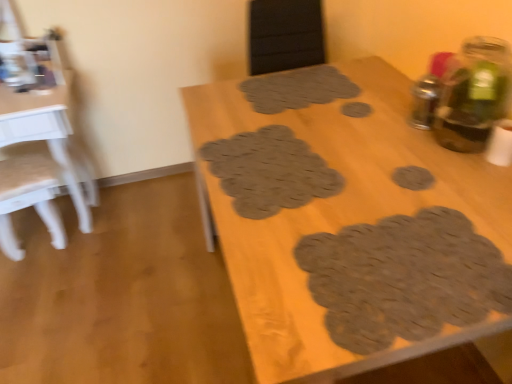
This screenshot has width=512, height=384. What are the coordinates of `vacant space in between brown textured mat at center, arranged as the second footprint when viewed from the front, and brown felt coaster at center, which ranks as the 4th footprint in bottom-to-top order` in the screenshot? It's located at (347, 141).